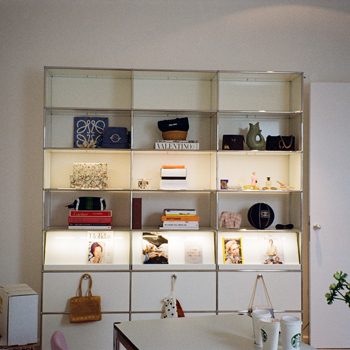
This screenshot has width=350, height=350. In order to click on shelving unit in this screenshot , I will do `click(257, 251)`.